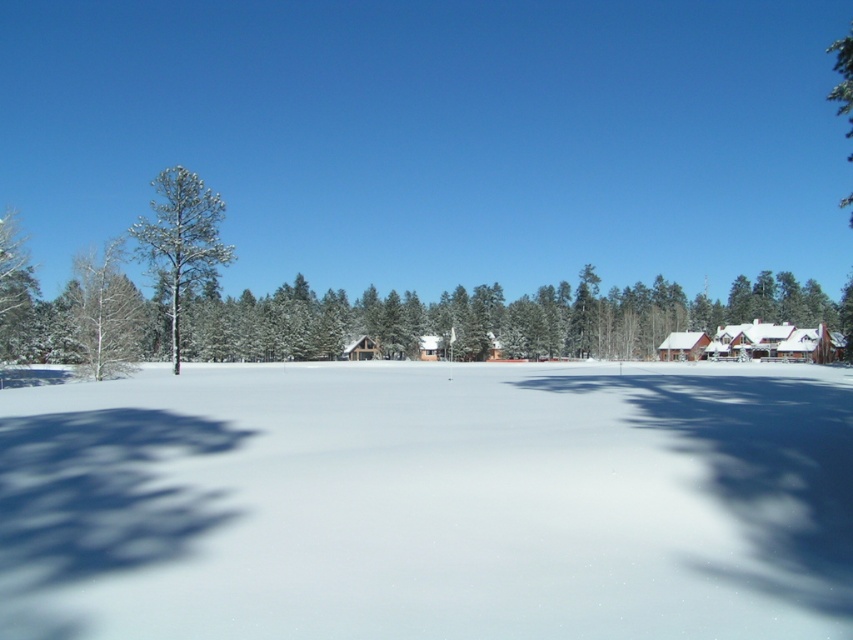
You are an observer standing in the winter landscape. You see the white fluffy snow at center and the white smooth tree at left. Which object is directly above the other?

The white smooth tree at left is directly above the white fluffy snow at center because the snow is positioned under the tree.

Based on the photo, you are planning to build a snowman using the white fluffy snow at center and the white smooth tree at left. Which object can you use to make the base of the snowman?

The white smooth tree at left cannot be used because it is a tree, while the white fluffy snow at center is the appropriate material for building the snowman base.